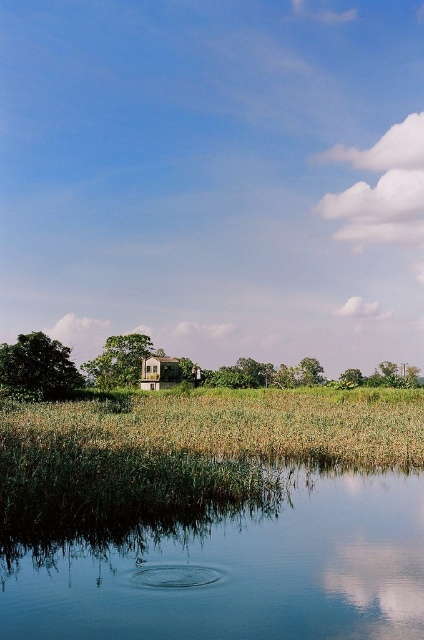
Is transparent glass water at lower center above green grassy field at center?

Yes.

Is transparent glass water at lower center smaller than green grassy field at center?

Yes, transparent glass water at lower center is smaller than green grassy field at center.

The height and width of the screenshot is (640, 424). In order to click on transparent glass water at lower center in this screenshot , I will do [x=236, y=570].

Does green grassy field at center have a smaller size compared to wooden hut at center?

Actually, green grassy field at center might be larger than wooden hut at center.

Who is more distant from viewer, (x=139, y=404) or (x=175, y=378)?

The point (x=175, y=378) is more distant.

Does point (44, 413) come closer to viewer compared to point (161, 358)?

Yes.

Locate an element on the screen. The image size is (424, 640). green grassy field at center is located at coordinates (240, 424).

Can you confirm if transparent glass water at lower center is positioned to the left of wooden hut at center?

No, transparent glass water at lower center is not to the left of wooden hut at center.

Who is positioned more to the left, transparent glass water at lower center or wooden hut at center?

From the viewer's perspective, wooden hut at center appears more on the left side.

Identify the location of transparent glass water at lower center. (236, 570).

The width and height of the screenshot is (424, 640). Identify the location of transparent glass water at lower center. (236, 570).